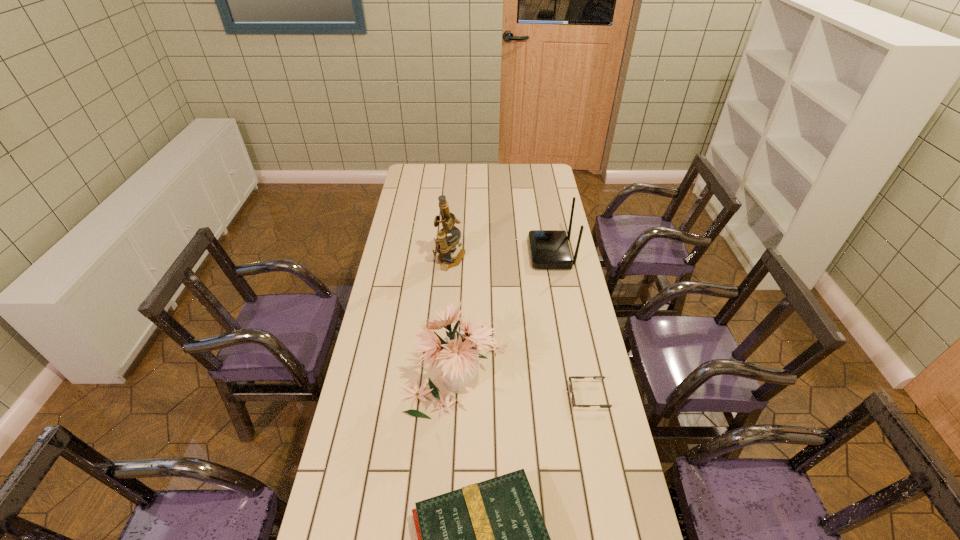
Find the location of a particular element. The width and height of the screenshot is (960, 540). microscope is located at coordinates (445, 245).

Locate an element on the screen. bouquet is located at coordinates (459, 352).

Identify the location of the third tallest object. (549, 249).

The image size is (960, 540). I want to click on sunglasses, so click(574, 377).

You are a GUI agent. You are given a task and a screenshot of the screen. Output one action in this format:
    pyautogui.click(x=<x>, y=<y>)
    Task: Click on the vacant area located 0.240m on the back of the microscope
    Image resolution: width=960 pixels, height=540 pixels.
    Given the screenshot: What is the action you would take?
    pyautogui.click(x=453, y=217)

Identify the location of vacant space located 0.290m on the back of the bouquet. The height and width of the screenshot is (540, 960). (463, 272).

Locate an element on the screen. The width and height of the screenshot is (960, 540). free location located on the front-facing side of the third shortest object is located at coordinates (476, 254).

The height and width of the screenshot is (540, 960). In order to click on free space located 0.110m on the front-facing side of the third shortest object in this screenshot , I will do `click(504, 254)`.

The height and width of the screenshot is (540, 960). Identify the location of vacant space located 0.290m on the front-facing side of the third shortest object. coord(463,254).

You are a GUI agent. You are given a task and a screenshot of the screen. Output one action in this format:
    pyautogui.click(x=<x>, y=<y>)
    Task: Click on the vacant space located on the temples of the shortest object
    
    Given the screenshot: What is the action you would take?
    pyautogui.click(x=525, y=396)